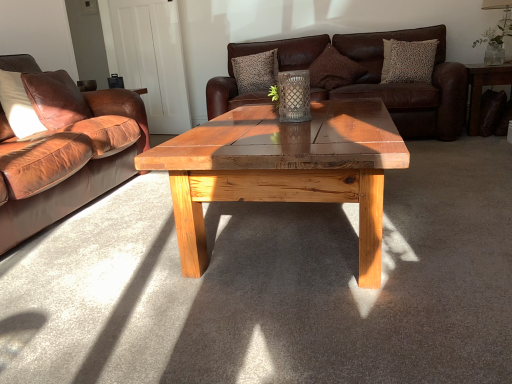
At what (x,y) coordinates should I click in order to perform the action: click on vacant point to the right of brown leather couch at left, marked as the 1th studio couch in a left-to-right arrangement. Please return your answer as a coordinate pair (x, y). This screenshot has height=384, width=512. Looking at the image, I should click on (173, 232).